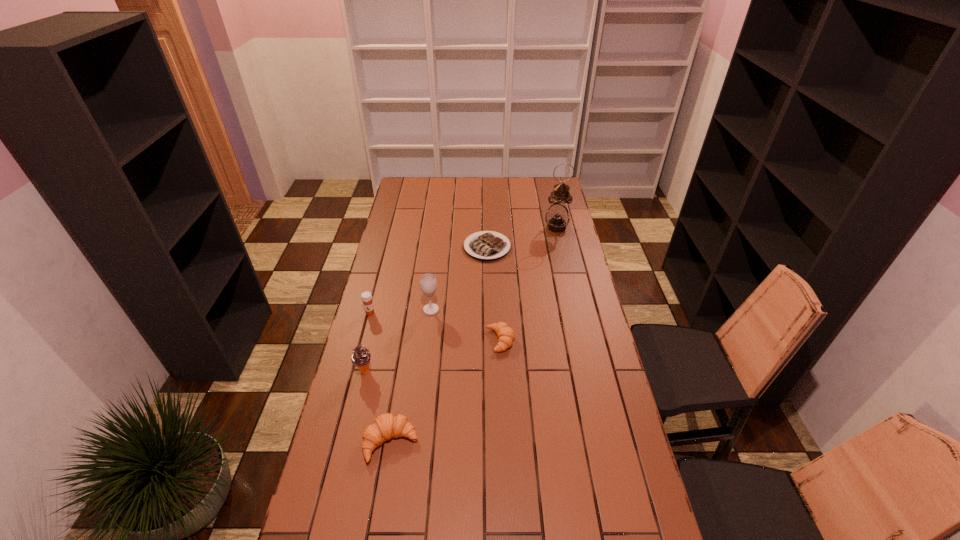
Where is `free point that keeps the crescent rolls evenly spaced on the right`? This screenshot has height=540, width=960. free point that keeps the crescent rolls evenly spaced on the right is located at coordinates (575, 270).